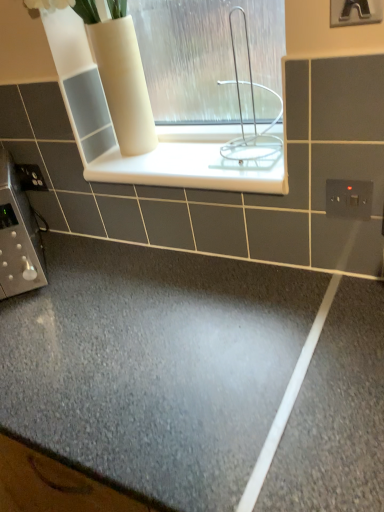
Find the location of a particular element. vacant area on top of white glossy ledge at center (from a real-world perspective) is located at coordinates (177, 162).